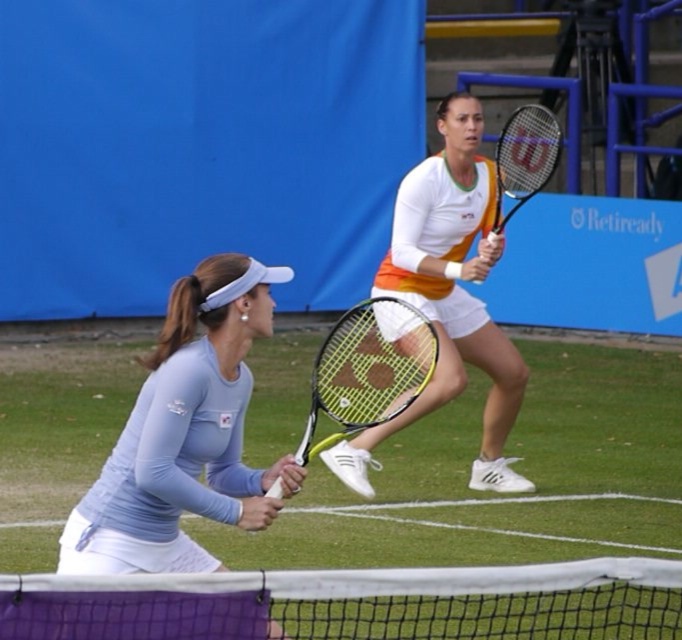
How far apart are yellow-green frame racket at center and yellow wilson tennis racket at upper center?

yellow-green frame racket at center and yellow wilson tennis racket at upper center are 2.33 meters apart.

What do you see at coordinates (368, 369) in the screenshot?
I see `yellow-green frame racket at center` at bounding box center [368, 369].

Describe the element at coordinates (368, 369) in the screenshot. This screenshot has height=640, width=682. I see `yellow-green frame racket at center` at that location.

The image size is (682, 640). I want to click on yellow-green frame racket at center, so click(368, 369).

This screenshot has height=640, width=682. Describe the element at coordinates (357, 602) in the screenshot. I see `purple fabric net at center` at that location.

Between purple fabric net at center and yellow-green frame racket at center, which one is positioned lower?

purple fabric net at center is lower down.

Is point (419, 596) farther from viewer compared to point (396, 381)?

No.

This screenshot has width=682, height=640. In order to click on purple fabric net at center in this screenshot , I will do `click(357, 602)`.

Can you confirm if orange fabric tennis outfit at center is positioned to the left of yellow-green frame racket at center?

No, orange fabric tennis outfit at center is not to the left of yellow-green frame racket at center.

The height and width of the screenshot is (640, 682). I want to click on orange fabric tennis outfit at center, so click(x=447, y=298).

I want to click on orange fabric tennis outfit at center, so click(447, 298).